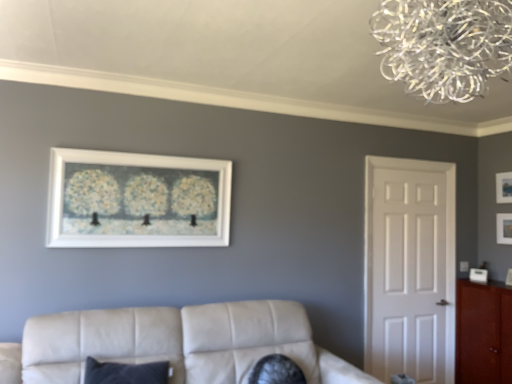
Question: Is white matte door at right positioned behind matte black picture frame at upper right, arranged as the first picture frame when viewed from the back?

Choices:
 (A) yes
 (B) no

Answer: (B)

Question: Is white matte door at right to the right of matte black picture frame at upper right, arranged as the first picture frame when viewed from the back, from the viewer's perspective?

Choices:
 (A) no
 (B) yes

Answer: (A)

Question: Is white matte door at right turned away from matte black picture frame at upper right, which ranks as the third picture frame in left-to-right order?

Choices:
 (A) no
 (B) yes

Answer: (A)

Question: Can you confirm if white matte door at right is taller than matte black picture frame at upper right, which ranks as the third picture frame in left-to-right order?

Choices:
 (A) yes
 (B) no

Answer: (A)

Question: Can you confirm if white matte door at right is thinner than matte black picture frame at upper right, the 3th picture frame positioned from the front?

Choices:
 (A) no
 (B) yes

Answer: (B)

Question: Looking at their shapes, would you say white matte door at right is wider or thinner than matte white picture frame at upper right, which appears as the second picture frame when viewed from the front?

Choices:
 (A) thin
 (B) wide

Answer: (A)

Question: Is white matte door at right bigger or smaller than matte white picture frame at upper right, the second picture frame viewed from the left?

Choices:
 (A) small
 (B) big

Answer: (B)

Question: Is white matte door at right taller or shorter than matte white picture frame at upper right, the 2th picture frame from the right?

Choices:
 (A) short
 (B) tall

Answer: (B)

Question: Do you think white matte door at right is within matte white picture frame at upper right, the 2th picture frame from the right, or outside of it?

Choices:
 (A) inside
 (B) outside

Answer: (B)

Question: From the image's perspective, is mahogany wood cabinet at right above or below matte white picture frame at upper right, marked as the second picture frame in a back-to-front arrangement?

Choices:
 (A) above
 (B) below

Answer: (B)

Question: From a real-world perspective, relative to matte white picture frame at upper right, the second picture frame viewed from the left, is mahogany wood cabinet at right vertically above or below?

Choices:
 (A) below
 (B) above

Answer: (A)

Question: Would you say mahogany wood cabinet at right is to the left or to the right of matte white picture frame at upper right, marked as the second picture frame in a back-to-front arrangement, in the picture?

Choices:
 (A) left
 (B) right

Answer: (A)

Question: Does point (494, 334) appear closer or farther from the camera than point (510, 230)?

Choices:
 (A) farther
 (B) closer

Answer: (B)

Question: Does point (508, 173) appear closer or farther from the camera than point (436, 180)?

Choices:
 (A) farther
 (B) closer

Answer: (B)

Question: Would you say matte black picture frame at upper right, which ranks as the third picture frame in left-to-right order, is to the left or to the right of white matte door at right in the picture?

Choices:
 (A) left
 (B) right

Answer: (B)